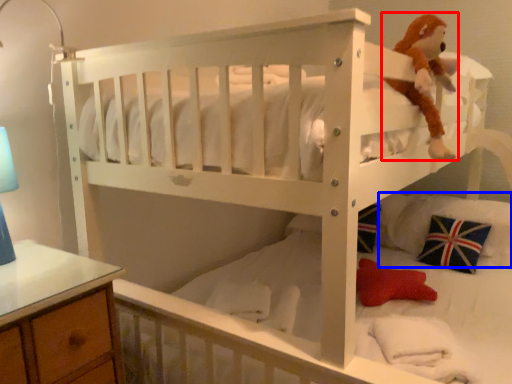
Question: Which object appears closest to the camera in this image, toy (highlighted by a red box) or pillow (highlighted by a blue box)?

Choices:
 (A) toy
 (B) pillow

Answer: (A)